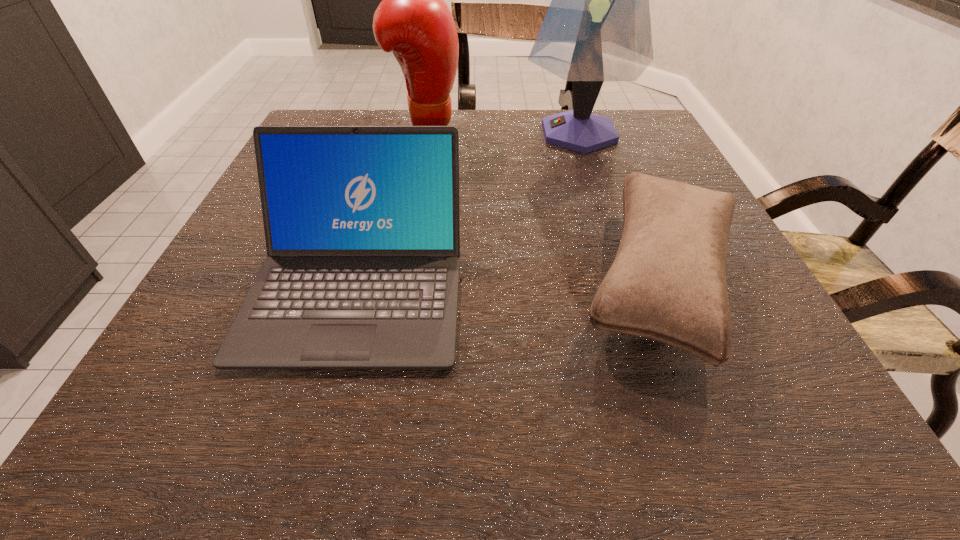
What are the coordinates of `lampshade` in the screenshot? It's located at (597, 28).

Image resolution: width=960 pixels, height=540 pixels. In order to click on boxing glove in this screenshot , I will do `click(412, 21)`.

This screenshot has width=960, height=540. Identify the location of the third tallest object. (362, 229).

Find the location of a particular element. This screenshot has height=540, width=960. the shortest object is located at coordinates (668, 283).

Where is `free point located 0.100m on the base of the tallest object`? This screenshot has width=960, height=540. free point located 0.100m on the base of the tallest object is located at coordinates (482, 133).

This screenshot has height=540, width=960. I want to click on vacant space located on the base of the tallest object, so click(390, 133).

Identify the location of vacant area situated 0.220m on the base of the tallest object. (434, 133).

Image resolution: width=960 pixels, height=540 pixels. I want to click on vacant region located 0.200m on the striking surface of the second tallest object, so click(540, 129).

This screenshot has height=540, width=960. Identify the location of vacant point located 0.070m on the screen of the laptop computer. (321, 419).

This screenshot has height=540, width=960. Find the location of `vacant region located on the left of the cushion`. vacant region located on the left of the cushion is located at coordinates pyautogui.click(x=426, y=279).